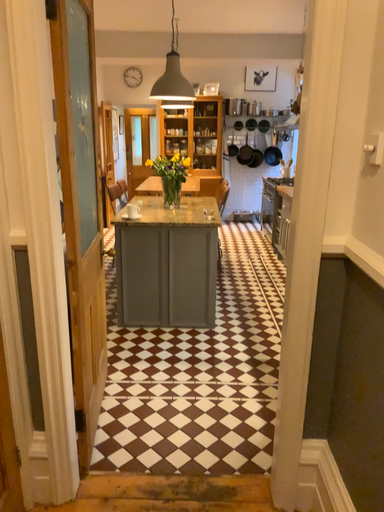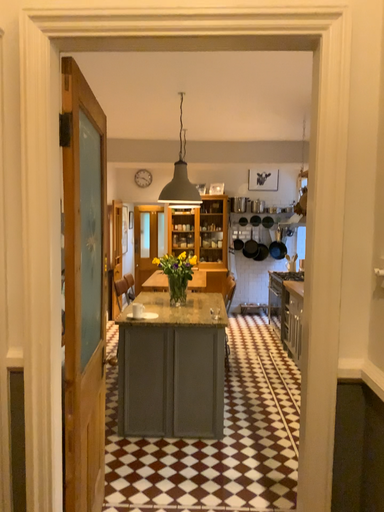
Question: How did the camera likely rotate when shooting the video?

Choices:
 (A) rotated downward
 (B) rotated upward

Answer: (B)